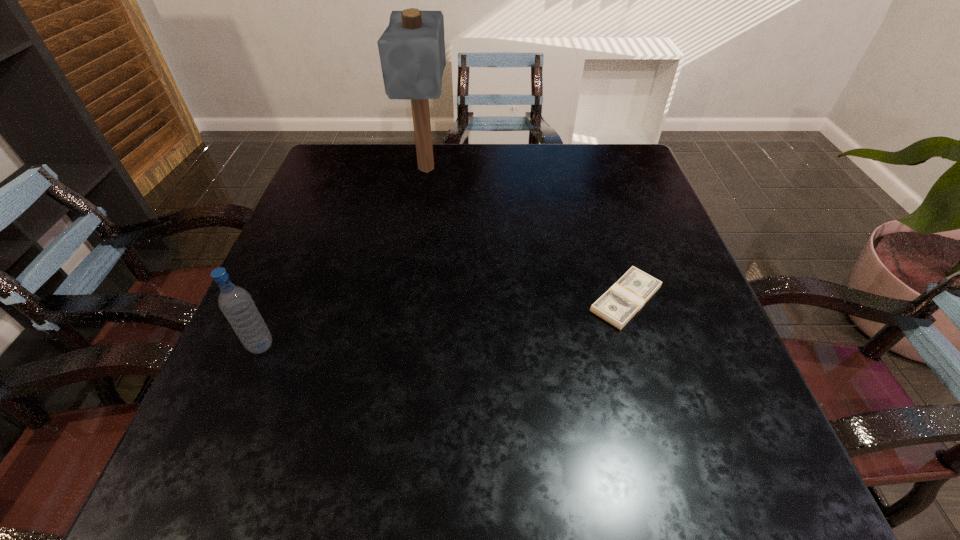
You are a GUI agent. You are given a task and a screenshot of the screen. Output one action in this format:
    pyautogui.click(x=<x>, y=<y>)
    Task: Click on the object that is at the left edge
    Image resolution: width=960 pixels, height=540 pixels.
    Given the screenshot: What is the action you would take?
    click(236, 304)

Locate an element on the screen. object that is at the right edge is located at coordinates (628, 295).

In the image, there is a desktop. At what (x,y) coordinates should I click in order to perform the action: click on vacant space at the far edge. Please return your answer as a coordinate pair (x, y). Image resolution: width=960 pixels, height=540 pixels. Looking at the image, I should click on (567, 188).

I want to click on free space at the near edge of the desktop, so click(462, 484).

Find the location of `vacant space at the left edge of the desktop`. vacant space at the left edge of the desktop is located at coordinates (244, 413).

This screenshot has width=960, height=540. Identify the location of free location at the right edge of the desktop. (617, 255).

I want to click on vacant space at the far left corner of the desktop, so click(x=327, y=154).

In order to click on free space at the near left corner of the desktop in this screenshot , I will do `click(177, 482)`.

Where is `vacant region at the far right corner`? The width and height of the screenshot is (960, 540). vacant region at the far right corner is located at coordinates (635, 190).

Where is `blank area at the near right corner`? The width and height of the screenshot is (960, 540). blank area at the near right corner is located at coordinates (679, 489).